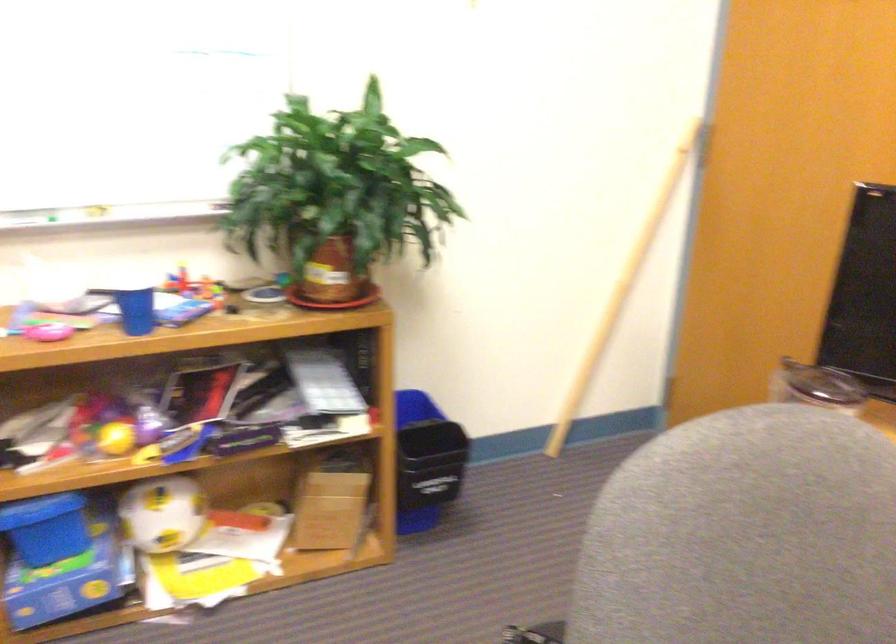
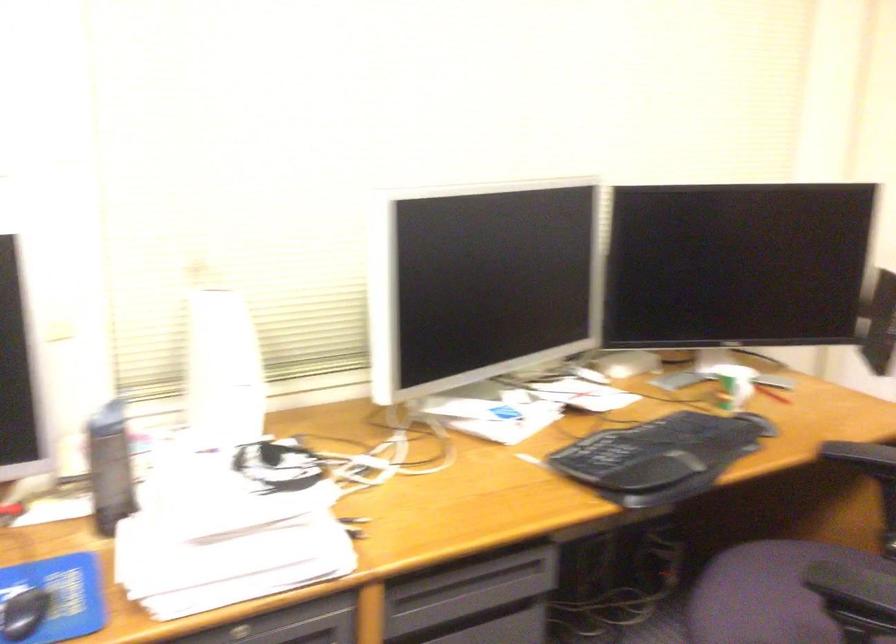
Question: The first image is from the beginning of the video and the second image is from the end. How did the camera likely rotate when shooting the video?

Choices:
 (A) Left
 (B) Right
 (C) Up
 (D) Down

Answer: (A)